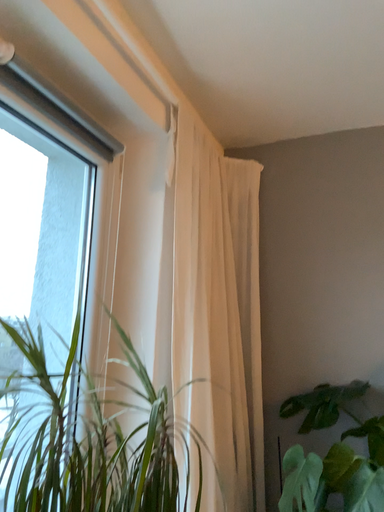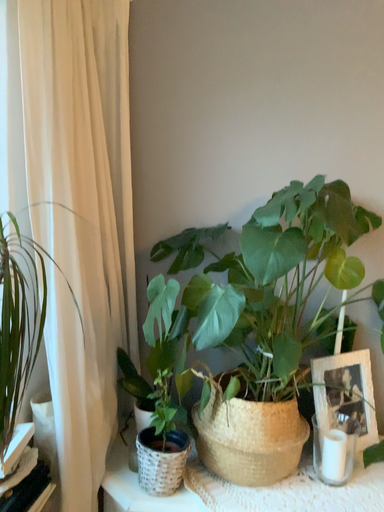
Question: Which way did the camera rotate in the video?

Choices:
 (A) rotated left
 (B) rotated right

Answer: (B)